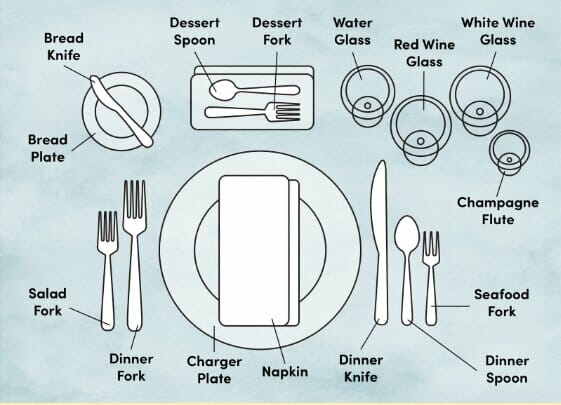
Where is `knives`? knives is located at coordinates (114, 106), (383, 235).